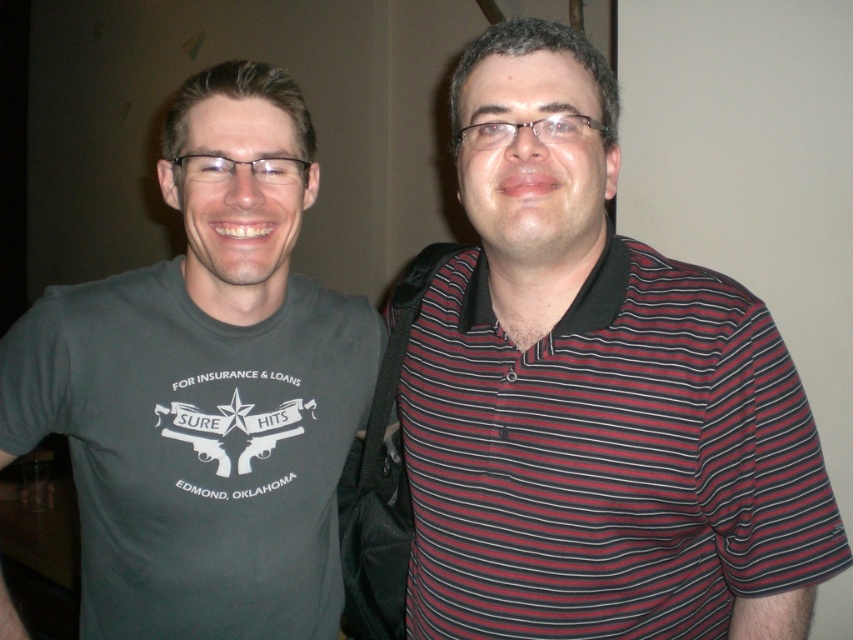
Can you confirm if striped cotton polo shirt at right is shorter than dark gray t-shirt at left?

Yes.

Between point (665, 355) and point (331, 452), which one is positioned in front?

Point (665, 355)

What do you see at coordinates (595, 396) in the screenshot? The height and width of the screenshot is (640, 853). I see `striped cotton polo shirt at right` at bounding box center [595, 396].

Find the location of a particular element. This screenshot has height=640, width=853. striped cotton polo shirt at right is located at coordinates [x=595, y=396].